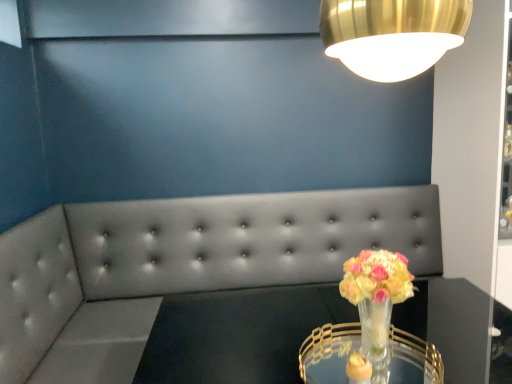
The width and height of the screenshot is (512, 384). I want to click on vacant space positioned to the left of clear glass table at center, so click(x=245, y=356).